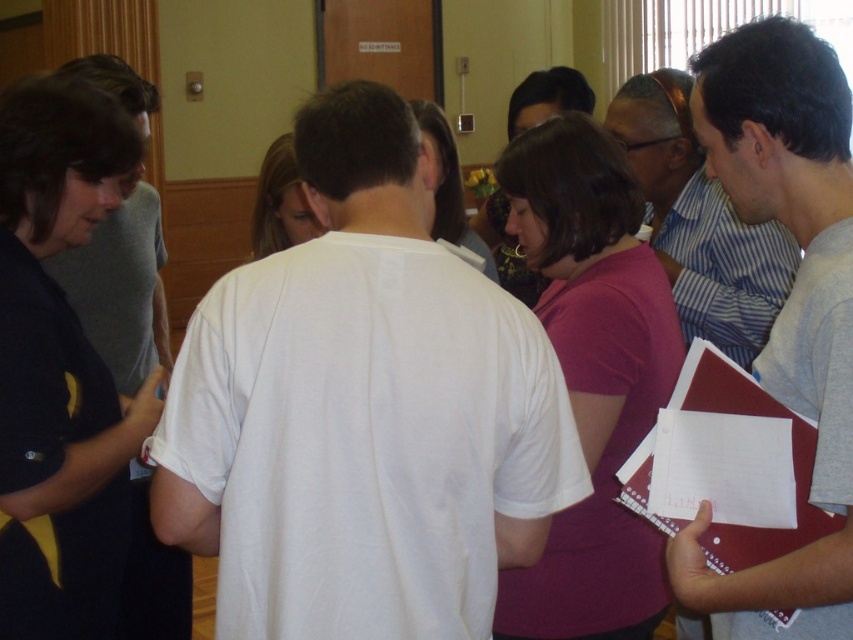
Is white matte t-shirt at center positioned at the back of gray striped shirt at center?

No, white matte t-shirt at center is in front of gray striped shirt at center.

Does white matte t-shirt at center appear under gray striped shirt at center?

Yes.

Between point (349, 240) and point (763, 326), which one is positioned behind?

Point (763, 326)

This screenshot has height=640, width=853. Find the location of `white matte t-shirt at center`. white matte t-shirt at center is located at coordinates (363, 412).

Is black matte shirt at left taller than gray matte folder at center-right?

Indeed, black matte shirt at left has a greater height compared to gray matte folder at center-right.

How far apart are black matte shirt at left and gray matte folder at center-right?

black matte shirt at left is 1.35 meters away from gray matte folder at center-right.

Between point (51, 577) and point (810, 160), which one is positioned behind?

The point (51, 577) is more distant.

Locate an element on the screen. black matte shirt at left is located at coordinates (61, 369).

Does white matte t-shirt at center have a larger size compared to gray matte folder at center-right?

Correct, white matte t-shirt at center is larger in size than gray matte folder at center-right.

Does point (393, 148) lie behind point (780, 93)?

Yes, point (393, 148) is behind point (780, 93).

Does point (344, 163) come closer to viewer compared to point (811, 154)?

Yes, it is in front of point (811, 154).

The image size is (853, 640). I want to click on white matte t-shirt at center, so click(363, 412).